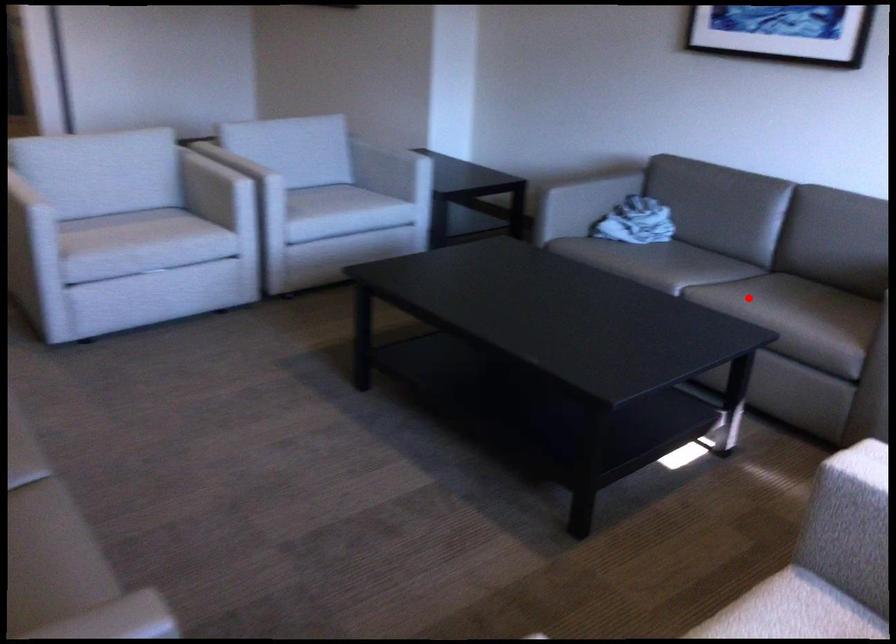
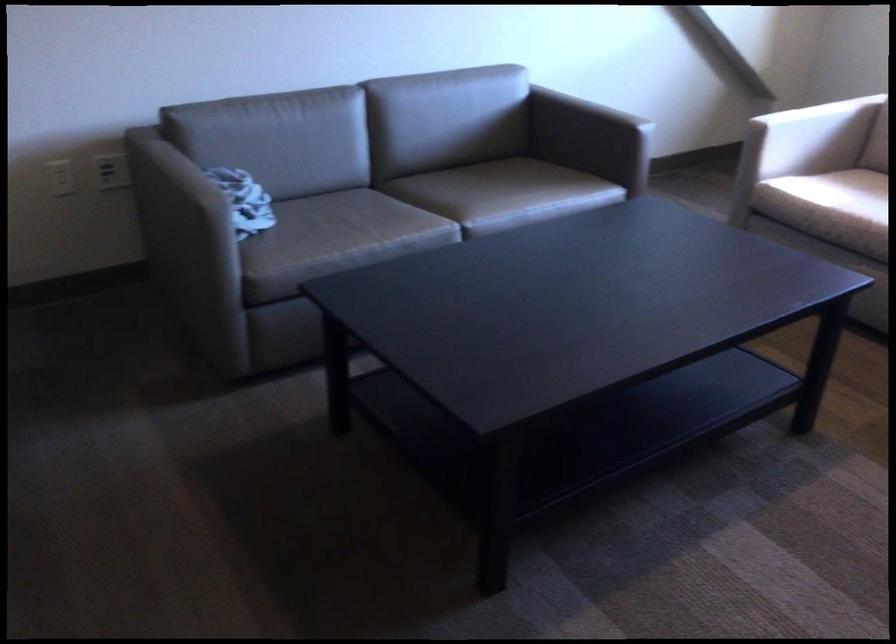
In the second image, find the point that corresponds to the highlighted location in the first image.

(489, 194)